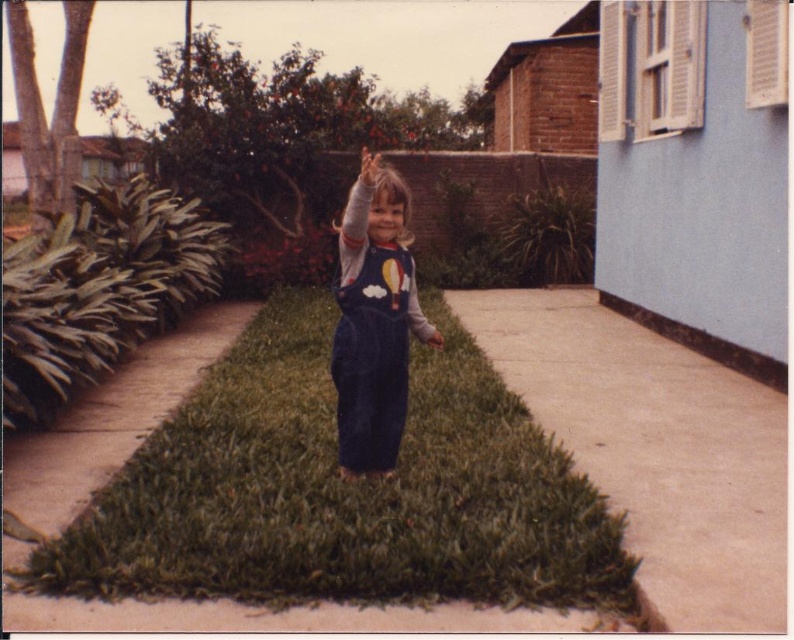
Question: Estimate the real-world distances between objects in this image. Which object is farther from the green grass at center?

Choices:
 (A) smooth concrete pavement at center
 (B) dark blue corduroy overalls at center

Answer: (A)

Question: Can you confirm if green grass at center is positioned to the right of smooth concrete pavement at center?

Choices:
 (A) no
 (B) yes

Answer: (A)

Question: Among these points, which one is nearest to the camera?

Choices:
 (A) (272, 356)
 (B) (748, 577)

Answer: (B)

Question: Which point is closer to the camera taking this photo?

Choices:
 (A) (721, 541)
 (B) (469, 460)

Answer: (A)

Question: Is green grass at center to the left of smooth concrete pavement at center from the viewer's perspective?

Choices:
 (A) no
 (B) yes

Answer: (B)

Question: Can you confirm if green grass at center is positioned above dark blue corduroy overalls at center?

Choices:
 (A) yes
 (B) no

Answer: (B)